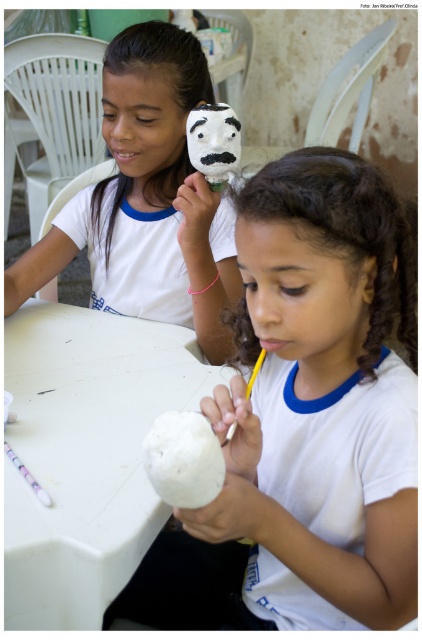
Is white matte egg at center taller than white matte coconut at center?

Correct, white matte egg at center is much taller as white matte coconut at center.

Can you confirm if white matte egg at center is positioned below white matte coconut at center?

No, white matte egg at center is not below white matte coconut at center.

Describe the element at coordinates (321, 397) in the screenshot. The width and height of the screenshot is (422, 640). I see `white matte egg at center` at that location.

Find the location of a particular element. This screenshot has height=640, width=422. white matte egg at center is located at coordinates (321, 397).

Which is more to the left, white plastic table at center or white matte coconut at center?

white plastic table at center is more to the left.

Is white plastic table at center smaller than white matte coconut at center?

Actually, white plastic table at center might be larger than white matte coconut at center.

Locate an element on the screen. white plastic table at center is located at coordinates (86, 454).

Can you confirm if smooth white mask at upper center is wider than yellow matte pencil at center?

Yes.

Is smooth white mask at upper center positioned before yellow matte pencil at center?

No.

Image resolution: width=422 pixels, height=640 pixels. What do you see at coordinates (141, 122) in the screenshot?
I see `smooth white mask at upper center` at bounding box center [141, 122].

Find the location of a particular element. smooth white mask at upper center is located at coordinates (141, 122).